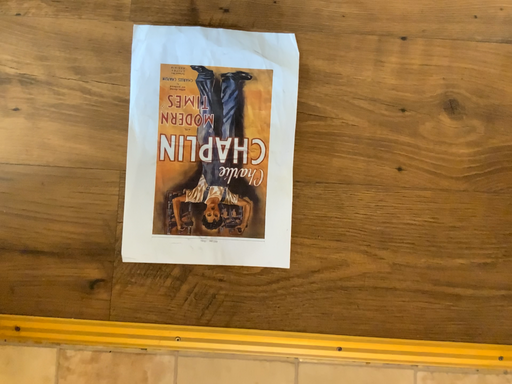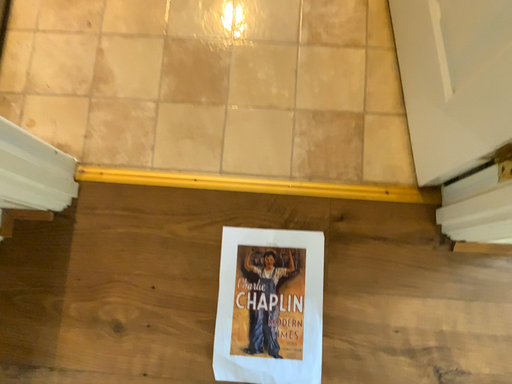
Question: Which way did the camera rotate in the video?

Choices:
 (A) rotated upward
 (B) rotated downward

Answer: (A)